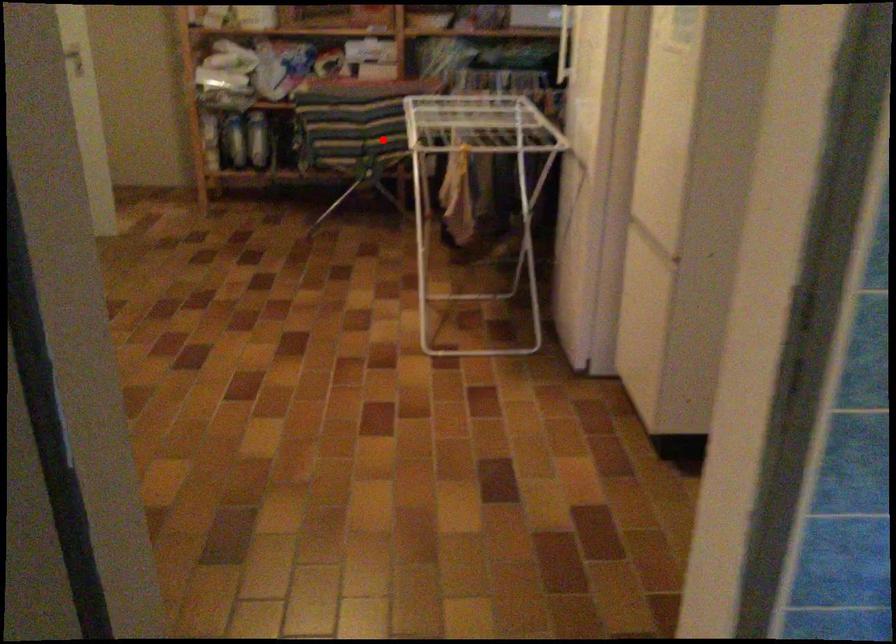
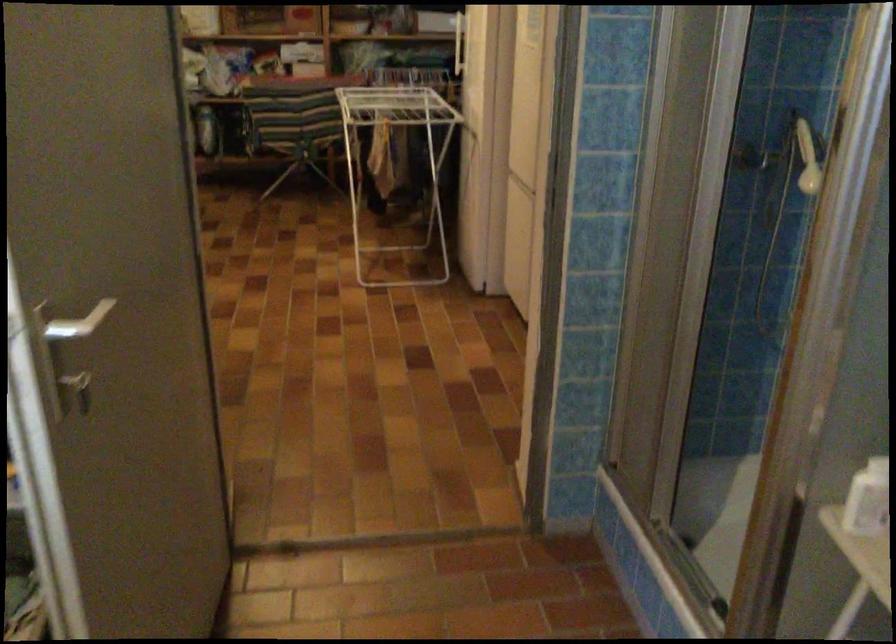
Find the pixel in the second image that matches the highlighted location in the first image.

(306, 128)